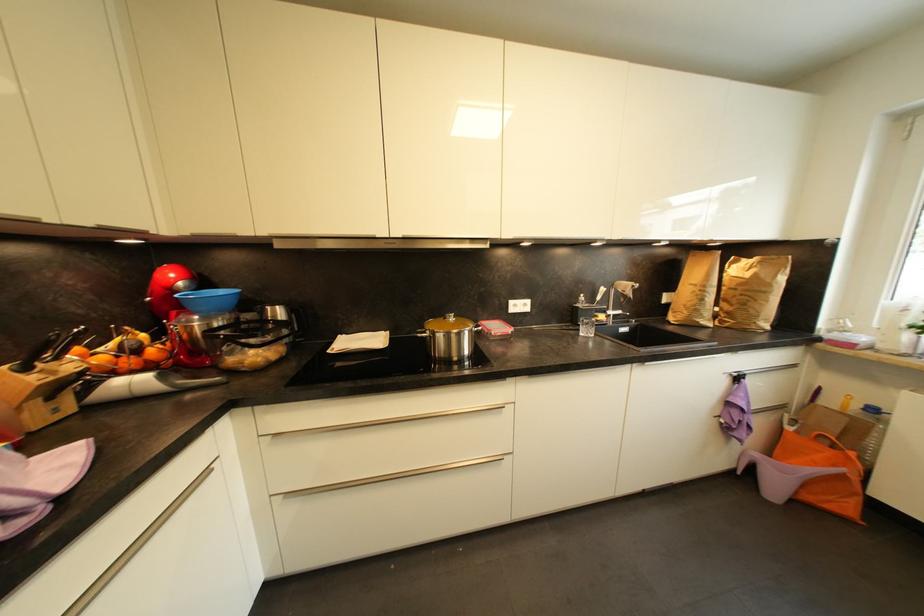
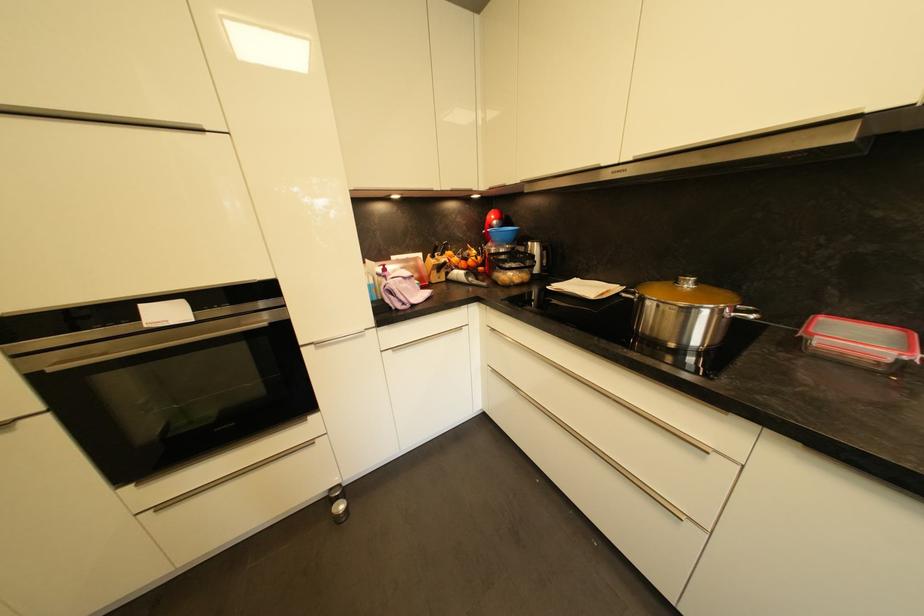
Where in the second image is the point corresponding to pixel 191 379 from the first image?

(481, 281)